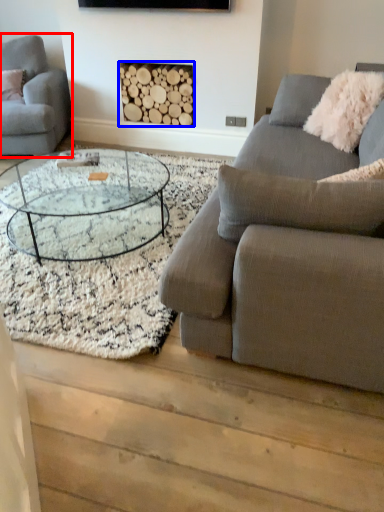
Question: Which object appears closest to the camera in this image, studio couch (highlighted by a red box) or fireplace (highlighted by a blue box)?

Choices:
 (A) studio couch
 (B) fireplace

Answer: (A)